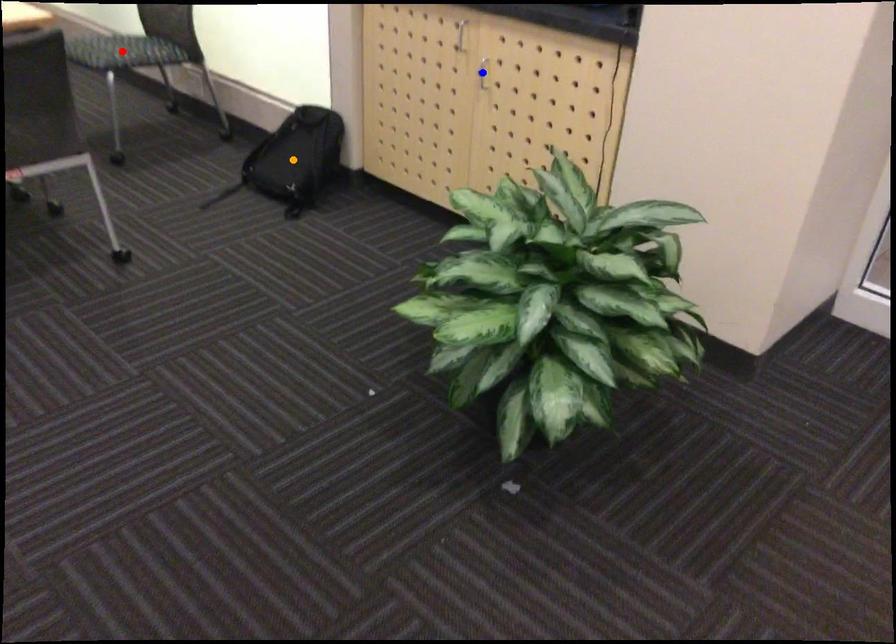
Order these from nearest to farthest:
red point
orange point
blue point

red point → orange point → blue point